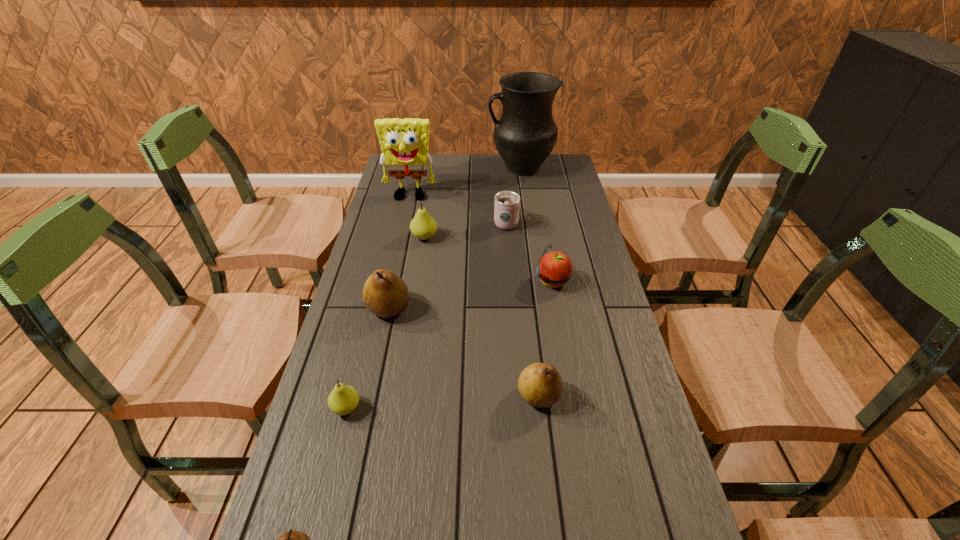
I want to click on vacant space located on the side with the handle of the cup, so click(503, 186).

At what (x,y) coordinates should I click in order to perform the action: click on vacant space located 0.400m on the side with the handle of the cup. Please return your answer as a coordinate pair (x, y). Looking at the image, I should click on (501, 159).

You are a GUI agent. You are given a task and a screenshot of the screen. Output one action in this format:
    pyautogui.click(x=<x>, y=<y>)
    Task: Click on the vacant space located 0.300m on the right of the right green pear
    
    Given the screenshot: What is the action you would take?
    pyautogui.click(x=529, y=237)

Find the location of a particular element. The image size is (960, 540). blank space located on the right of the second biggest brown pear is located at coordinates (609, 396).

At what (x,y) coordinates should I click in order to perform the action: click on vacant space located 0.370m on the left of the apple. Please return your answer as a coordinate pair (x, y). Looking at the image, I should click on (411, 281).

Identify the location of free spot located on the right of the nearer green pear. (446, 408).

Identify the location of object located in the far edge section of the desktop. The width and height of the screenshot is (960, 540). point(524,136).

Locate an element on the screen. This screenshot has height=540, width=960. sponge positioned at the left edge is located at coordinates (404, 142).

This screenshot has width=960, height=540. What are the coordinates of `pitcher that is at the right edge` in the screenshot? It's located at (524, 136).

The image size is (960, 540). Find the location of `apple positioned at the right edge`. apple positioned at the right edge is located at coordinates (555, 269).